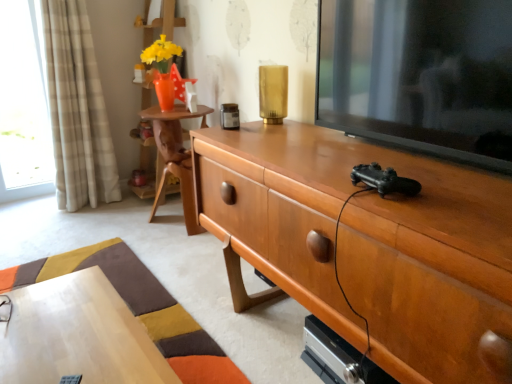
Identify the location of space that is in front of beige plaid curtain at left. This screenshot has width=512, height=384. (68, 224).